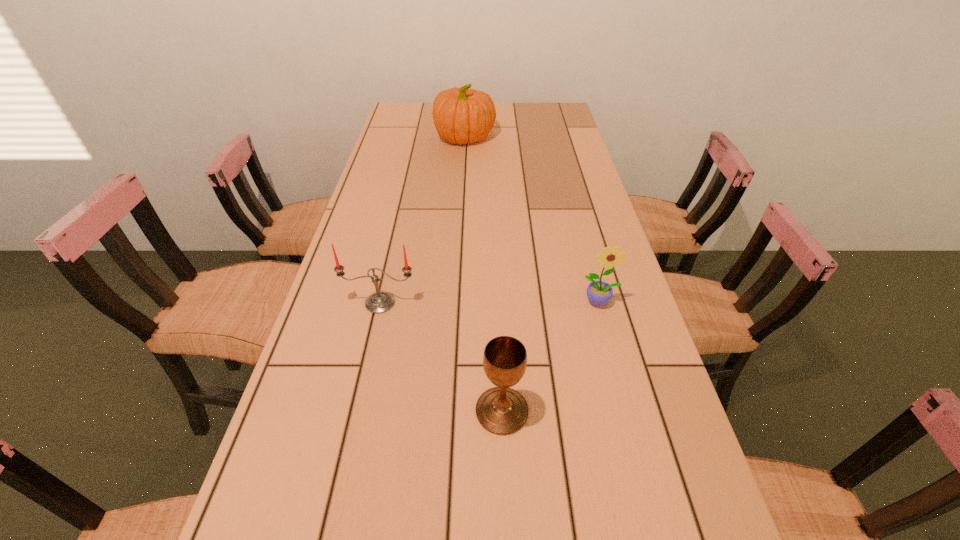
Where is `vacant point located between the nearest object and the sunflower`? The width and height of the screenshot is (960, 540). vacant point located between the nearest object and the sunflower is located at coordinates (551, 356).

In order to click on free spot between the pumpkin and the sunflower in this screenshot , I will do `click(532, 220)`.

You are a GUI agent. You are given a task and a screenshot of the screen. Output one action in this format:
    pyautogui.click(x=<x>, y=<y>)
    Task: Click on the free space between the candle and the rightmost object
    
    Given the screenshot: What is the action you would take?
    pyautogui.click(x=490, y=302)

Where is `empty space that is in between the pumpkin and the candle`? This screenshot has height=540, width=960. empty space that is in between the pumpkin and the candle is located at coordinates (422, 220).

Find the location of a particular element. The height and width of the screenshot is (540, 960). free space between the chalice and the pumpkin is located at coordinates (484, 274).

Locate an element on the screen. the closest object to the farthest object is located at coordinates point(379,302).

This screenshot has width=960, height=540. In order to click on object that is the third closest to the nearest object in this screenshot , I will do `click(461, 115)`.

Find the location of a particular element. The height and width of the screenshot is (540, 960). free space that satisfies the following two spatial constraints: 1. on the surface of the pumpkin; 2. on the right side of the chalice is located at coordinates (449, 411).

The width and height of the screenshot is (960, 540). What are the coordinates of `vacant space that satisfies the following two spatial constraints: 1. on the front-facing side of the candle; 2. on the right side of the nearest object` in the screenshot? It's located at (355, 411).

You are a GUI agent. You are given a task and a screenshot of the screen. Output one action in this format:
    pyautogui.click(x=<x>, y=<y>)
    Task: Click on the vacant space that satisfies the following two spatial constraints: 1. on the surface of the farthest object; 2. on the front-facing side of the candle
    This screenshot has height=540, width=960.
    Given the screenshot: What is the action you would take?
    pyautogui.click(x=456, y=303)